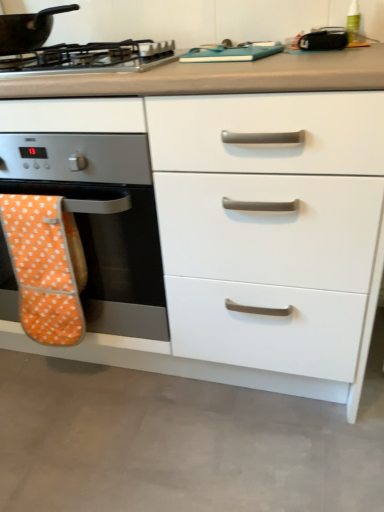
Question: From the image's perspective, is orange fabric oven mitt at left beneath black matte pan at upper left?

Choices:
 (A) no
 (B) yes

Answer: (B)

Question: Considering the relative sizes of orange fabric oven mitt at left and black matte pan at upper left in the image provided, is orange fabric oven mitt at left smaller than black matte pan at upper left?

Choices:
 (A) yes
 (B) no

Answer: (B)

Question: Could you tell me if orange fabric oven mitt at left is facing black matte pan at upper left?

Choices:
 (A) yes
 (B) no

Answer: (B)

Question: Is orange fabric oven mitt at left with black matte pan at upper left?

Choices:
 (A) no
 (B) yes

Answer: (A)

Question: Considering the relative sizes of orange fabric oven mitt at left and black matte pan at upper left in the image provided, is orange fabric oven mitt at left shorter than black matte pan at upper left?

Choices:
 (A) no
 (B) yes

Answer: (A)

Question: Is point (279, 375) closer or farther from the camera than point (13, 237)?

Choices:
 (A) farther
 (B) closer

Answer: (A)

Question: From a real-world perspective, is white glossy drawer at center positioned above or below orange polka dot oven mitt at left?

Choices:
 (A) above
 (B) below

Answer: (A)

Question: From their relative heights in the image, would you say white glossy drawer at center is taller or shorter than orange polka dot oven mitt at left?

Choices:
 (A) tall
 (B) short

Answer: (A)

Question: Is white glossy drawer at center situated inside orange polka dot oven mitt at left or outside?

Choices:
 (A) inside
 (B) outside

Answer: (B)

Question: Considering the positions of black matte pan at upper left and metallic silver gas stove at upper left in the image, is black matte pan at upper left bigger or smaller than metallic silver gas stove at upper left?

Choices:
 (A) small
 (B) big

Answer: (A)

Question: From the image's perspective, relative to metallic silver gas stove at upper left, is black matte pan at upper left above or below?

Choices:
 (A) above
 (B) below

Answer: (A)

Question: From a real-world perspective, is black matte pan at upper left above or below metallic silver gas stove at upper left?

Choices:
 (A) below
 (B) above

Answer: (B)

Question: Is black matte pan at upper left in front of or behind metallic silver gas stove at upper left in the image?

Choices:
 (A) front
 (B) behind

Answer: (B)

Question: Considering their positions, is orange polka dot oven mitt at left located in front of or behind white glossy drawer at center?

Choices:
 (A) behind
 (B) front

Answer: (A)

Question: Considering the relative positions of orange polka dot oven mitt at left and white glossy drawer at center in the image provided, is orange polka dot oven mitt at left to the left or to the right of white glossy drawer at center?

Choices:
 (A) left
 (B) right

Answer: (A)